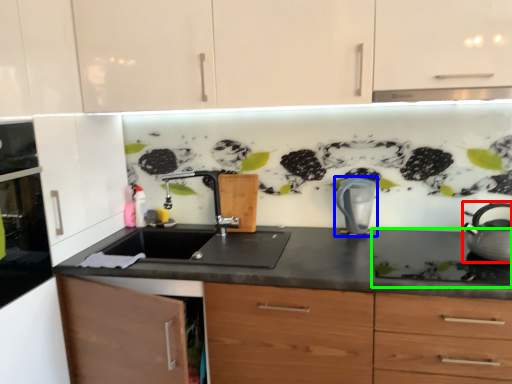
Question: Based on their relative distances, which object is nearer to kitchen appliance (highlighted by a red box)? Choose from kitchen appliance (highlighted by a blue box) and gas stove (highlighted by a green box).

Choices:
 (A) kitchen appliance
 (B) gas stove

Answer: (B)